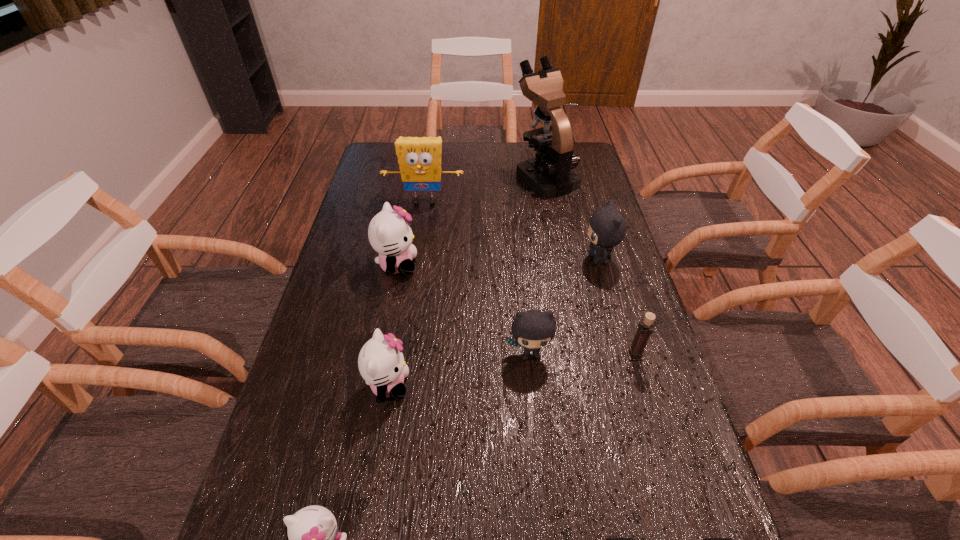
The width and height of the screenshot is (960, 540). I want to click on sponge at the left edge, so click(419, 159).

Identify the location of kitten that is at the left edge. (390, 235).

In order to click on microscope that is at the right edge in this screenshot , I will do `click(550, 174)`.

I want to click on kitten that is at the right edge, so click(x=607, y=227).

The height and width of the screenshot is (540, 960). I want to click on candle holder that is positioned at the right edge, so click(x=645, y=326).

Locate an element on the screen. object that is at the far right corner is located at coordinates (550, 174).

In the image, there is a desktop. Identify the location of free space at the far edge. Image resolution: width=960 pixels, height=540 pixels. pos(449,164).

Where is `vacant space at the left edge of the desktop`? The width and height of the screenshot is (960, 540). vacant space at the left edge of the desktop is located at coordinates (378, 254).

Locate an element on the screen. The image size is (960, 540). vacant space at the right edge is located at coordinates (586, 226).

In the image, there is a desktop. Identify the location of free space at the far left corner. (386, 154).